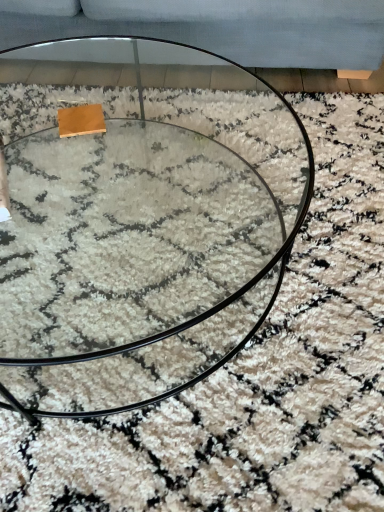
Describe the element at coordinates (140, 234) in the screenshot. I see `clear glass coffee table at center` at that location.

Identify the location of clear glass coffee table at center. (140, 234).

The height and width of the screenshot is (512, 384). Identify the location of clear glass coffee table at center. (140, 234).